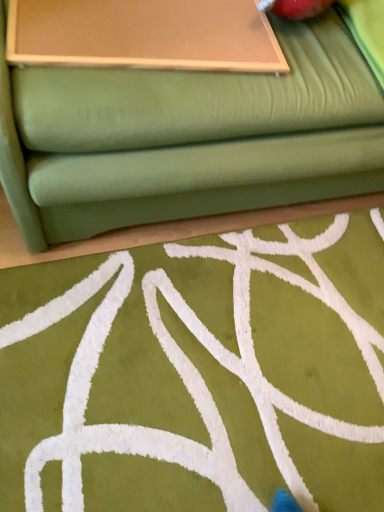
Question: From a real-world perspective, is green fabric studio couch at upper center above or below matte brown board at upper center?

Choices:
 (A) above
 (B) below

Answer: (B)

Question: From the image's perspective, relative to matte brown board at upper center, is green fabric studio couch at upper center above or below?

Choices:
 (A) above
 (B) below

Answer: (A)

Question: Is green fabric studio couch at upper center in front of or behind matte brown board at upper center in the image?

Choices:
 (A) front
 (B) behind

Answer: (A)

Question: Looking at their shapes, would you say matte brown board at upper center is wider or thinner than green fabric studio couch at upper center?

Choices:
 (A) thin
 (B) wide

Answer: (A)

Question: From a real-world perspective, is matte brown board at upper center physically located above or below green fabric studio couch at upper center?

Choices:
 (A) above
 (B) below

Answer: (A)

Question: In the image, is matte brown board at upper center positioned in front of or behind green fabric studio couch at upper center?

Choices:
 (A) behind
 (B) front

Answer: (A)

Question: From the image's perspective, is matte brown board at upper center above or below green fabric studio couch at upper center?

Choices:
 (A) above
 (B) below

Answer: (B)